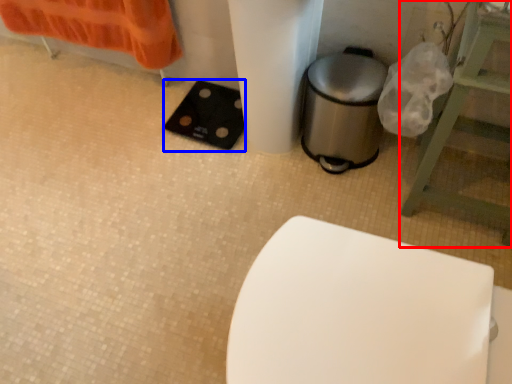
Question: Which object is closer to the camera taking this photo, furniture (highlighted by a red box) or pad (highlighted by a blue box)?

Choices:
 (A) furniture
 (B) pad

Answer: (A)